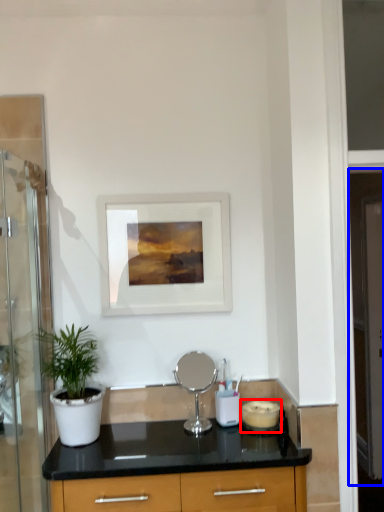
Question: Which object appears farthest to the camera in this image, appliance (highlighted by a red box) or screen door (highlighted by a blue box)?

Choices:
 (A) appliance
 (B) screen door

Answer: (B)